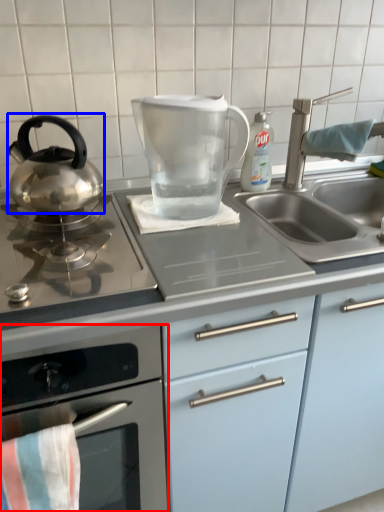
Question: Among these objects, which one is nearest to the camera, kitchen appliance (highlighted by a red box) or kitchen appliance (highlighted by a blue box)?

Choices:
 (A) kitchen appliance
 (B) kitchen appliance

Answer: (A)